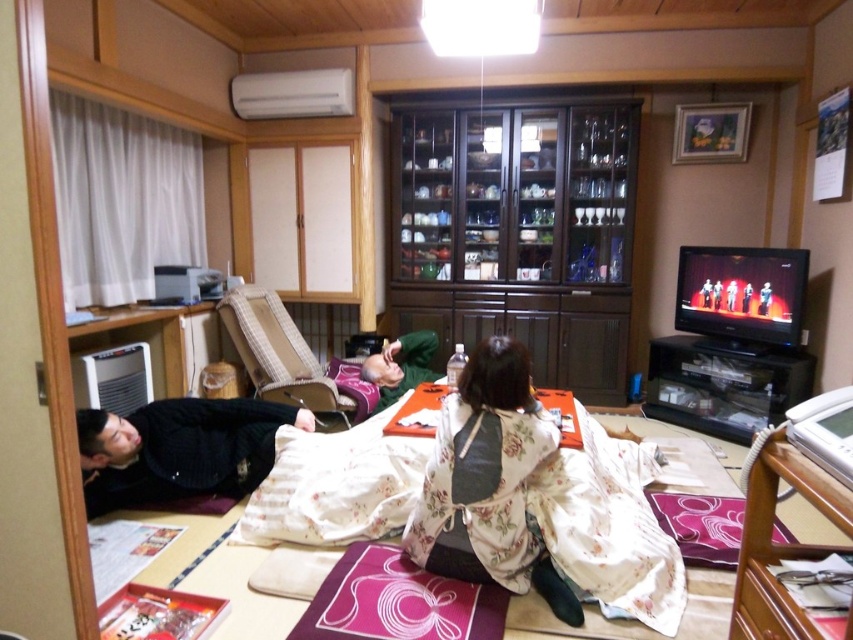
Between dark wood cabinet at center and black sweater at lower left, which one is positioned higher?

dark wood cabinet at center

Identify the location of dark wood cabinet at center. The image size is (853, 640). (519, 232).

From the picture: Who is more distant from viewer, (398, 172) or (241, 449)?

Positioned behind is point (398, 172).

Where is `dark wood cabinet at center`? dark wood cabinet at center is located at coordinates (519, 232).

Does black sweater at lower left appear on the left side of green matte kimono at center?

Yes, black sweater at lower left is to the left of green matte kimono at center.

Does black sweater at lower left have a lesser height compared to green matte kimono at center?

Yes, black sweater at lower left is shorter than green matte kimono at center.

Who is more forward, (183, 451) or (410, 371)?

Point (183, 451) is more forward.

Find the location of a particular element. The width and height of the screenshot is (853, 640). black sweater at lower left is located at coordinates (178, 449).

Is point (520, 522) in front of point (221, 451)?

Yes, point (520, 522) is closer to viewer.

Which of these two, floral silk kimono at center or black sweater at lower left, stands shorter?

With less height is black sweater at lower left.

This screenshot has height=640, width=853. Describe the element at coordinates (488, 483) in the screenshot. I see `floral silk kimono at center` at that location.

The width and height of the screenshot is (853, 640). What are the coordinates of `floral silk kimono at center` in the screenshot? It's located at (488, 483).